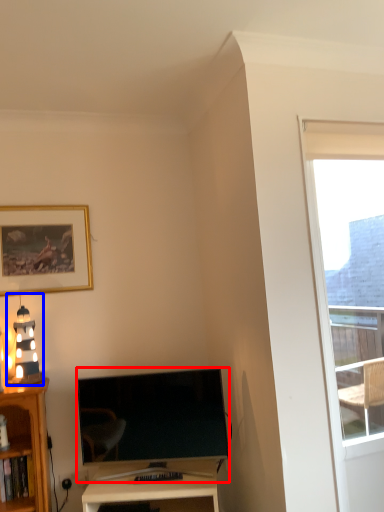
Question: Which point is closer to the camera, television (highlighted by a red box) or light fixture (highlighted by a blue box)?

Choices:
 (A) television
 (B) light fixture

Answer: (A)